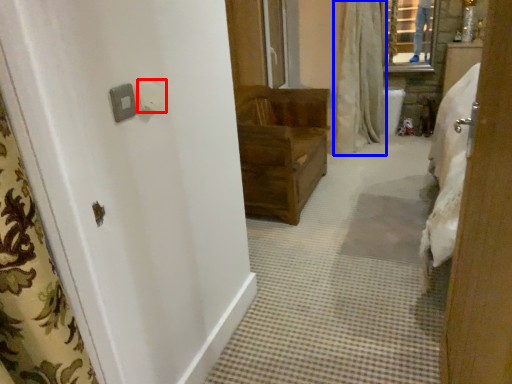
Question: Which object is further to the camera taking this photo, light switch (highlighted by a red box) or shower curtain (highlighted by a blue box)?

Choices:
 (A) light switch
 (B) shower curtain

Answer: (B)